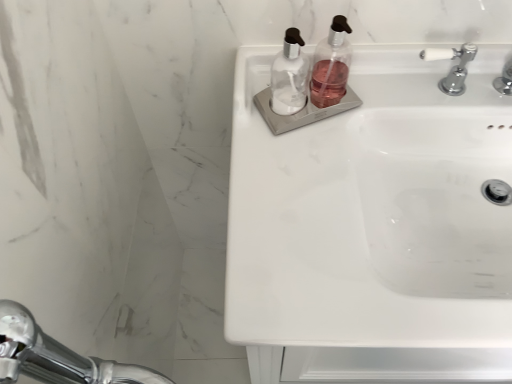
Find the location of a particular element. Image resolution: width=512 pixels, height=384 pixels. free point behind transparent plastic soap dispenser at center, which is the 1th soap dispenser from left to right is located at coordinates (281, 81).